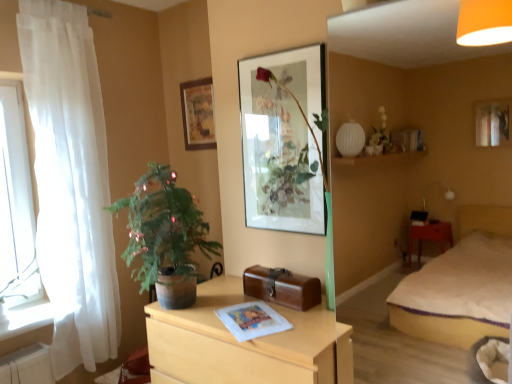
At what (x,y) coordinates should I click in order to perform the action: click on vacant position to the left of brown leather suitcase at center. Please return your answer as a coordinate pair (x, y). Image resolution: width=512 pixels, height=384 pixels. Looking at the image, I should click on (227, 306).